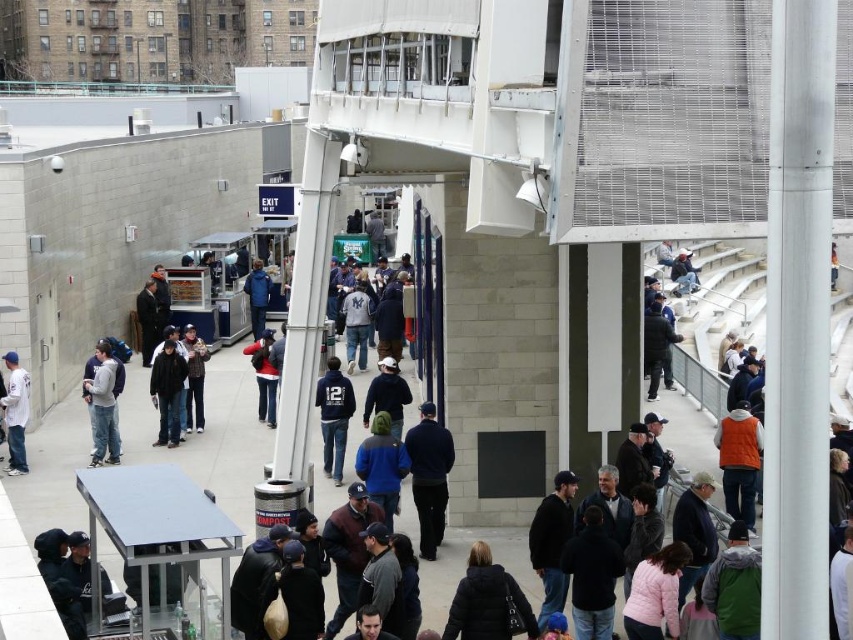
What do you see at coordinates (334, 417) in the screenshot?
I see `dark blue jersey at center` at bounding box center [334, 417].

Does dark blue jersey at center appear over matte gray hoodie at center?

Yes, dark blue jersey at center is above matte gray hoodie at center.

This screenshot has height=640, width=853. I want to click on dark blue jersey at center, so pyautogui.click(x=334, y=417).

Where is `dark blue jersey at center`? dark blue jersey at center is located at coordinates coord(334,417).

Is black puffer jacket at center in front of dark blue sweater at center?

Yes, it is.

Does black puffer jacket at center come behind dark blue sweater at center?

That is False.

This screenshot has width=853, height=640. I want to click on black puffer jacket at center, so click(486, 602).

Locate an element on the screen. The height and width of the screenshot is (640, 853). black puffer jacket at center is located at coordinates (486, 602).

Is orange fleece jacket at right smaller than dark blue jersey at center?

Actually, orange fleece jacket at right might be larger than dark blue jersey at center.

Does orange fleece jacket at right lie behind dark blue jersey at center?

No, it is not.

Who is more distant from viewer, (715, 435) or (320, 406)?

The point (320, 406) is more distant.

I want to click on orange fleece jacket at right, so click(x=740, y=461).